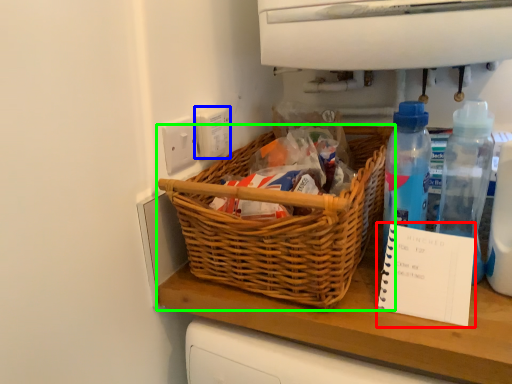
Question: Considering the real-world distances, which object is farthest from notebook (highlighted by a red box)? electric outlet (highlighted by a blue box) or picnic basket (highlighted by a green box)?

Choices:
 (A) electric outlet
 (B) picnic basket

Answer: (A)